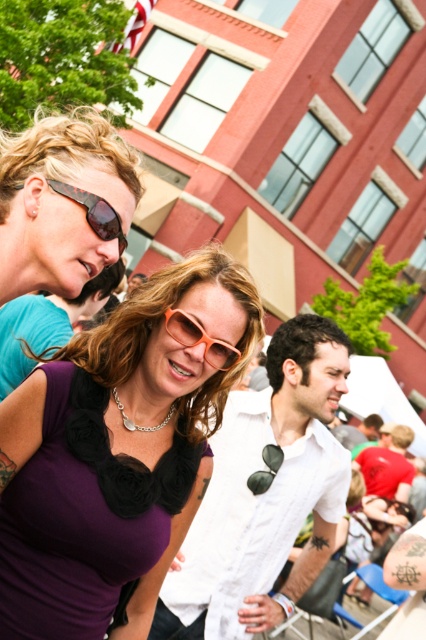
Who is positioned more to the right, matte black sunglasses at upper left or matte white shirt at center?

matte white shirt at center is more to the right.

Consider the image. Is matte black sunglasses at upper left closer to the viewer compared to matte white shirt at center?

Yes, matte black sunglasses at upper left is in front of matte white shirt at center.

Which is in front, point (106, 163) or point (411, 474)?

Point (106, 163) is more forward.

At what (x,y) coordinates should I click in order to perform the action: click on matte black sunglasses at upper left. Please return your answer as a coordinate pair (x, y). This screenshot has height=640, width=426. Looking at the image, I should click on (63, 204).

Describe the element at coordinates (115, 449) in the screenshot. I see `purple fabric top at center` at that location.

Can you confirm if purple fabric top at center is positioned below matte black sunglasses at upper left?

Yes, purple fabric top at center is below matte black sunglasses at upper left.

Find the location of a particular element. This screenshot has width=426, height=640. purple fabric top at center is located at coordinates (115, 449).

Is point (363, 454) positioned in front of point (186, 321)?

No, it is behind (186, 321).

Is matte white shirt at center to the right of orange matte sunglasses at center from the viewer's perspective?

Yes, matte white shirt at center is to the right of orange matte sunglasses at center.

Based on the photo, measure the distance between point (406, 490) and camera.

They are 10.65 meters apart.

Find the location of `matte white shirt at center`. matte white shirt at center is located at coordinates (388, 465).